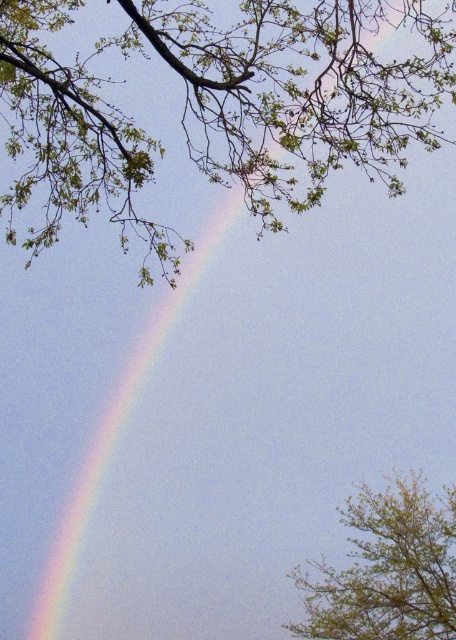
Measure the distance between green leafy branches at upper left and camera.

A distance of 8.31 meters exists between green leafy branches at upper left and camera.

Consider the image. Is green leafy branches at upper left to the left of green leafy tree at upper right from the viewer's perspective?

Correct, you'll find green leafy branches at upper left to the left of green leafy tree at upper right.

Does point (98, 96) lie in front of point (367, 560)?

Yes, point (98, 96) is in front of point (367, 560).

Find the location of a particular element. The width and height of the screenshot is (456, 640). green leafy branches at upper left is located at coordinates (218, 106).